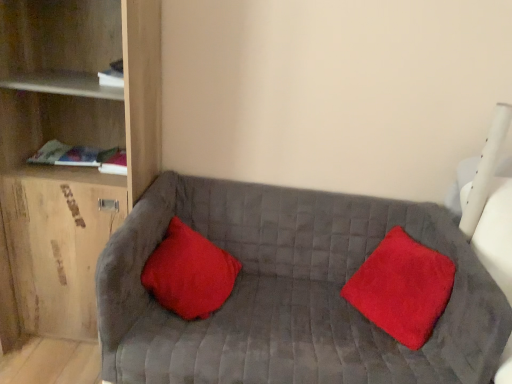
Image resolution: width=512 pixels, height=384 pixels. Describe the element at coordinates (72, 144) in the screenshot. I see `wooden shelf at left` at that location.

At what (x,y) coordinates should I click in order to perform the action: click on red plush pillow at center, marked as the first pillow in a right-to-left arrangement. Please return your answer as a coordinate pair (x, y). Looking at the image, I should click on (402, 288).

Based on the photo, is red velvet pillow at center, which is the first pillow in left-to-right order, located outside wooden shelf at left?

red velvet pillow at center, which is the first pillow in left-to-right order, lies outside wooden shelf at left's area.

Can you confirm if red velvet pillow at center, which is the first pillow in left-to-right order, is wider than wooden shelf at left?

In fact, red velvet pillow at center, which is the first pillow in left-to-right order, might be narrower than wooden shelf at left.

Is point (161, 278) closer or farther from the camera than point (105, 99)?

Clearly, point (161, 278) is closer to the camera than point (105, 99).

Is red velvet pillow at center, which is the first pillow in left-to-right order, not near wooden shelf at left?

They are positioned close to each other.

Is velvet gray couch at center aimed at wooden shelf at left?

No, velvet gray couch at center is not facing towards wooden shelf at left.

Is there a large distance between velvet gray couch at center and wooden shelf at left?

velvet gray couch at center is near wooden shelf at left, not far away.

Which of these two, velvet gray couch at center or wooden shelf at left, is wider?

velvet gray couch at center is wider.

From a real-world perspective, is velvet gray couch at center physically located above or below wooden shelf at left?

In terms of real-world spatial position, velvet gray couch at center is below wooden shelf at left.

Where is `pillow that is the 2nd one when counting backward from the velvet gray couch at center`? Image resolution: width=512 pixels, height=384 pixels. pillow that is the 2nd one when counting backward from the velvet gray couch at center is located at coordinates (189, 273).

Is red velvet pillow at center, which is the first pillow in left-to-right order, not close to velvet gray couch at center?

No, red velvet pillow at center, which is the first pillow in left-to-right order, is in close proximity to velvet gray couch at center.

Considering the relative sizes of red velvet pillow at center, which is the first pillow in left-to-right order, and velvet gray couch at center in the image provided, is red velvet pillow at center, which is the first pillow in left-to-right order, thinner than velvet gray couch at center?

Correct, the width of red velvet pillow at center, which is the first pillow in left-to-right order, is less than that of velvet gray couch at center.

Is red velvet pillow at center, which is the first pillow in left-to-right order, facing towards velvet gray couch at center?

Yes, red velvet pillow at center, which is the first pillow in left-to-right order, is oriented towards velvet gray couch at center.

Consider the image. Between wooden shelf at left and velvet gray couch at center, which one has more height?

Standing taller between the two is wooden shelf at left.

Between wooden shelf at left and velvet gray couch at center, which one has larger width?

With larger width is velvet gray couch at center.

Which is correct: wooden shelf at left is inside velvet gray couch at center, or outside of it?

wooden shelf at left lies outside velvet gray couch at center.

Is wooden shelf at left positioned before velvet gray couch at center?

No, wooden shelf at left is behind velvet gray couch at center.

In the scene shown: Considering the relative sizes of velvet gray couch at center and red plush pillow at center, marked as the first pillow in a right-to-left arrangement, in the image provided, is velvet gray couch at center wider than red plush pillow at center, marked as the first pillow in a right-to-left arrangement,?

Correct, the width of velvet gray couch at center exceeds that of red plush pillow at center, marked as the first pillow in a right-to-left arrangement.

Considering the sizes of objects velvet gray couch at center and red plush pillow at center, arranged as the second pillow when viewed from the left, in the image provided, who is taller, velvet gray couch at center or red plush pillow at center, arranged as the second pillow when viewed from the left,?

velvet gray couch at center.

Is velvet gray couch at center surrounding red plush pillow at center, arranged as the second pillow when viewed from the left?

Yes.

Is velvet gray couch at center to the right of red plush pillow at center, arranged as the second pillow when viewed from the left, from the viewer's perspective?

No, velvet gray couch at center is not to the right of red plush pillow at center, arranged as the second pillow when viewed from the left.

Which of these two, velvet gray couch at center or red velvet pillow at center, acting as the 2th pillow starting from the right, is wider?

velvet gray couch at center is wider.

From the image's perspective, is velvet gray couch at center on top of red velvet pillow at center, which is the first pillow in left-to-right order?

No, from the image's perspective, velvet gray couch at center is not over red velvet pillow at center, which is the first pillow in left-to-right order.

From a real-world perspective, which object rests below the other?

From a 3D spatial view, velvet gray couch at center is below.

Could you tell me if velvet gray couch at center is facing red velvet pillow at center, which is the first pillow in left-to-right order?

Yes, velvet gray couch at center is oriented towards red velvet pillow at center, which is the first pillow in left-to-right order.

Measure the distance between wooden shelf at left and red plush pillow at center, arranged as the second pillow when viewed from the left.

wooden shelf at left and red plush pillow at center, arranged as the second pillow when viewed from the left, are 3.77 feet apart from each other.

Based on their positions, is wooden shelf at left located to the left or right of red plush pillow at center, arranged as the second pillow when viewed from the left?

Based on their positions, wooden shelf at left is located to the left of red plush pillow at center, arranged as the second pillow when viewed from the left.

Based on the photo, could you tell me if wooden shelf at left is facing red plush pillow at center, marked as the first pillow in a right-to-left arrangement?

No, wooden shelf at left is not turned towards red plush pillow at center, marked as the first pillow in a right-to-left arrangement.

From a real-world perspective, is wooden shelf at left physically located above or below red plush pillow at center, marked as the first pillow in a right-to-left arrangement?

wooden shelf at left is situated higher than red plush pillow at center, marked as the first pillow in a right-to-left arrangement, in the real world.

Image resolution: width=512 pixels, height=384 pixels. In order to click on pillow that is the 1st object located below the wooden shelf at left (from the image's perspective) in this screenshot , I will do `click(189, 273)`.

Identify the location of shelf positioned vertically above the velvet gray couch at center (from a real-world perspective). This screenshot has height=384, width=512. (72, 144).

Which object lies nearer to the anchor point wooden shelf at left, velvet gray couch at center or red plush pillow at center, marked as the first pillow in a right-to-left arrangement?

velvet gray couch at center is closer to wooden shelf at left.

Looking at the image, which one is located further to red velvet pillow at center, acting as the 2th pillow starting from the right, wooden shelf at left or velvet gray couch at center?

wooden shelf at left.

From the image, which object appears to be nearer to wooden shelf at left, red velvet pillow at center, acting as the 2th pillow starting from the right, or velvet gray couch at center?

red velvet pillow at center, acting as the 2th pillow starting from the right, lies closer to wooden shelf at left than the other object.

Based on their spatial positions, is red velvet pillow at center, which is the first pillow in left-to-right order, or red plush pillow at center, arranged as the second pillow when viewed from the left, further from wooden shelf at left?

The object further to wooden shelf at left is red plush pillow at center, arranged as the second pillow when viewed from the left.

Which object lies further to the anchor point velvet gray couch at center, red velvet pillow at center, which is the first pillow in left-to-right order, or red plush pillow at center, arranged as the second pillow when viewed from the left?

The object further to velvet gray couch at center is red plush pillow at center, arranged as the second pillow when viewed from the left.

Which object lies further to the anchor point red plush pillow at center, arranged as the second pillow when viewed from the left, velvet gray couch at center or red velvet pillow at center, which is the first pillow in left-to-right order?

red velvet pillow at center, which is the first pillow in left-to-right order, lies further to red plush pillow at center, arranged as the second pillow when viewed from the left, than the other object.

Estimate the real-world distances between objects in this image. Which object is closer to red plush pillow at center, arranged as the second pillow when viewed from the left, velvet gray couch at center or wooden shelf at left?

velvet gray couch at center.

From the image, which object appears to be nearer to velvet gray couch at center, red plush pillow at center, marked as the first pillow in a right-to-left arrangement, or red velvet pillow at center, acting as the 2th pillow starting from the right?

red velvet pillow at center, acting as the 2th pillow starting from the right.

Find the location of `studio couch located between wooden shelf at left and red plush pillow at center, arranged as the second pillow when viewed from the left, in the left-right direction`. studio couch located between wooden shelf at left and red plush pillow at center, arranged as the second pillow when viewed from the left, in the left-right direction is located at coordinates (289, 292).

Identify the location of studio couch situated between red velvet pillow at center, which is the first pillow in left-to-right order, and red plush pillow at center, marked as the first pillow in a right-to-left arrangement, from left to right. Image resolution: width=512 pixels, height=384 pixels. (289, 292).

Locate an element on the screen. The image size is (512, 384). pillow situated between wooden shelf at left and red plush pillow at center, marked as the first pillow in a right-to-left arrangement, from left to right is located at coordinates (189, 273).

The height and width of the screenshot is (384, 512). I want to click on pillow between wooden shelf at left and velvet gray couch at center from left to right, so click(189, 273).